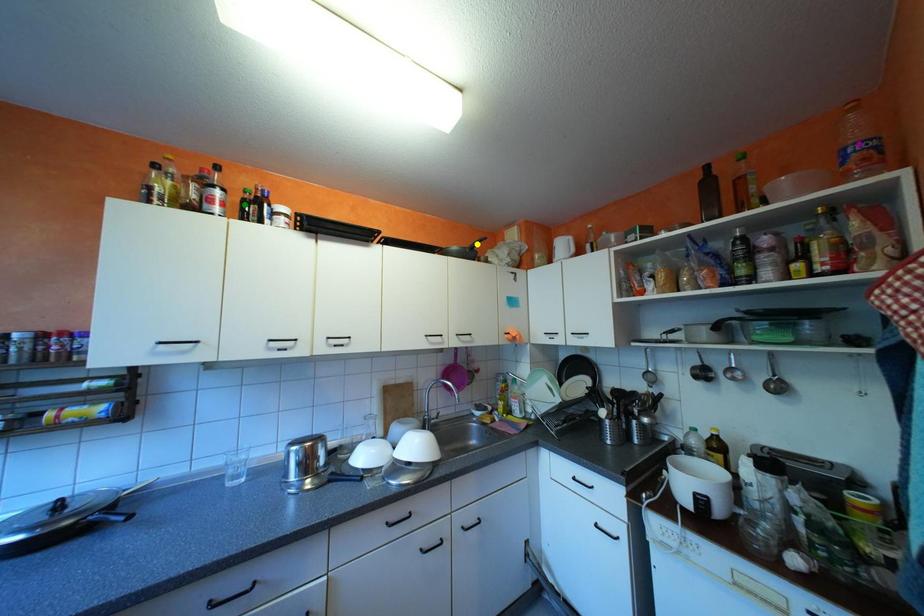
Order these from nearest to farthest:
yellow point
green point
purple point

purple point < green point < yellow point